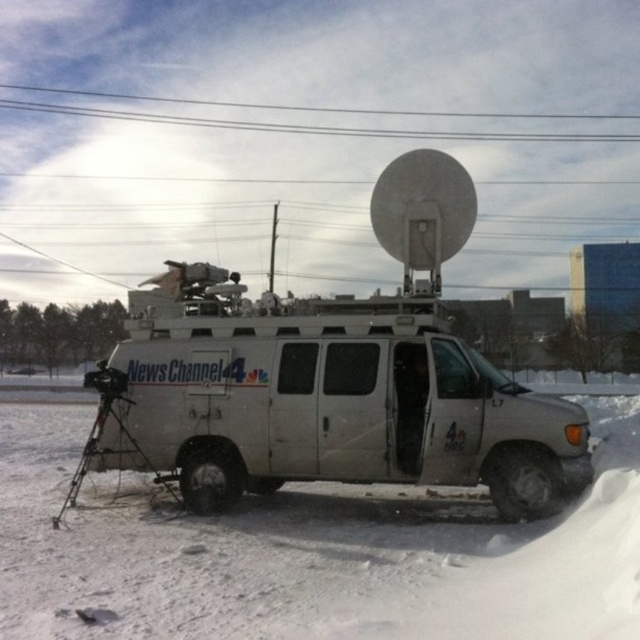
You are a delivery driver who needs to park your truck near the white metallic van at center without blocking the black wire at upper center. Based on the scene, where should you position your truck relative to the van?

You should park your truck behind the white metallic van at center since it is located below the black wire at upper center, ensuring the wire remains unobstructed.

You are a drone operator trying to capture aerial footage of the news van. You have two points marked on your screen for camera positioning. Which point, point (541, 541) or point (582, 410), is closer to the news van?

Point (541, 541) is closer to the viewer than point (582, 410), so it is closer to the news van.

You are a delivery person who needs to deliver a package to the white metallic van at center. You are currently standing on the white powdery snow at lower left. Can you walk directly to the van without stepping on any other objects?

The distance between the white powdery snow at lower left and the white metallic van at center is 19.25 feet, so yes, you can walk directly to the van without stepping on any other objects as there are no obstacles mentioned between them.